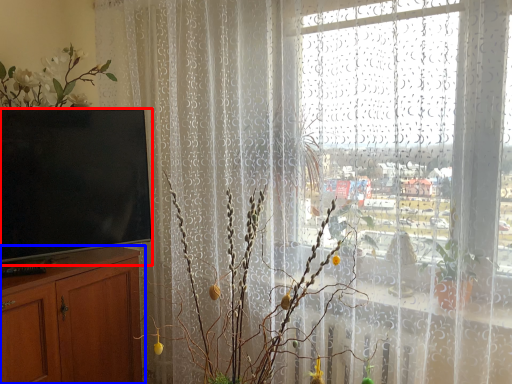
Question: Which object is closer to the camera taking this photo, television (highlighted by a red box) or cabinetry (highlighted by a blue box)?

Choices:
 (A) television
 (B) cabinetry

Answer: (B)